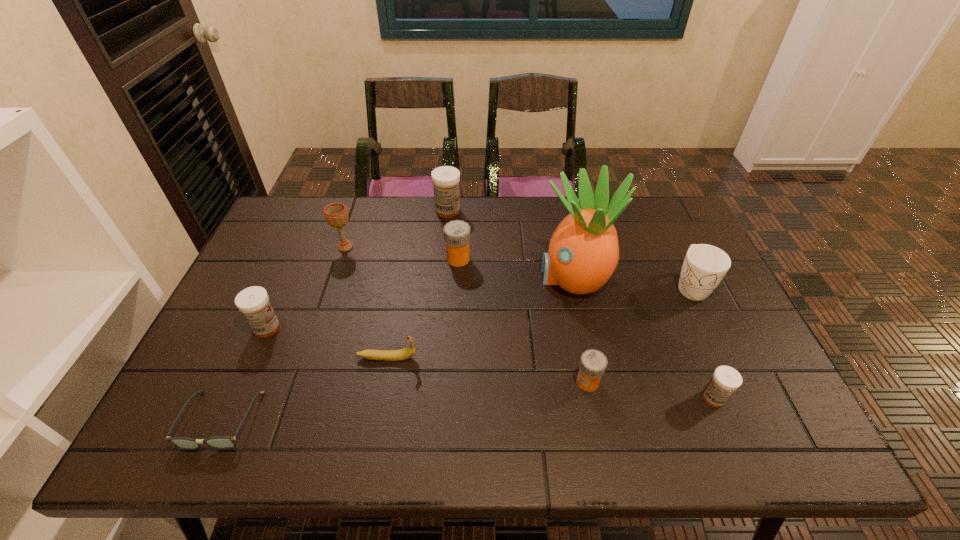
Locate an element on the screen. This screenshot has height=540, width=960. free space between the spectacles and the smaller orange medicine is located at coordinates pos(404,401).

What are the coordinates of `unoccupied position between the yellow banana and the shortest object` in the screenshot? It's located at (304, 389).

Find the location of a particular element. vacant space that is in between the farthest object and the leftmost medicine is located at coordinates 357,269.

Where is `vacant point located between the biggest white medicine and the nearer orange medicine`? Image resolution: width=960 pixels, height=540 pixels. vacant point located between the biggest white medicine and the nearer orange medicine is located at coordinates (517, 296).

You are a GUI agent. You are given a task and a screenshot of the screen. Output one action in this format:
    pyautogui.click(x=<x>, y=<y>)
    Task: Click on the vacant area that lies between the rightmost white medicine and the smaller orange medicine
    This screenshot has height=540, width=960.
    Given the screenshot: What is the action you would take?
    pyautogui.click(x=651, y=390)

Locate an element on the screen. This screenshot has height=540, width=960. free space that is in between the nearer orange medicine and the left orange medicine is located at coordinates (523, 320).

At what (x,y) coordinates should I click in order to perform the action: click on the third closest object relative to the left orange medicine. Please return your answer as a coordinate pair (x, y). Looking at the image, I should click on (336, 214).

Locate which object ranks eighth in proximity to the tallest medicine. Please provide its 2D coordinates. Your answer should be formatted as a tuple, i.e. [(x, y)], where the tuple contains the x and y coordinates of a point satisfying the conditions above.

[(217, 442)]

At what (x,y) coordinates should I click in order to perform the action: click on the fourth closest medicine to the tallest medicine. Please return your answer as a coordinate pair (x, y). The width and height of the screenshot is (960, 540). Looking at the image, I should click on (726, 380).

I want to click on medicine that is the nearest to the banana, so click(x=253, y=302).